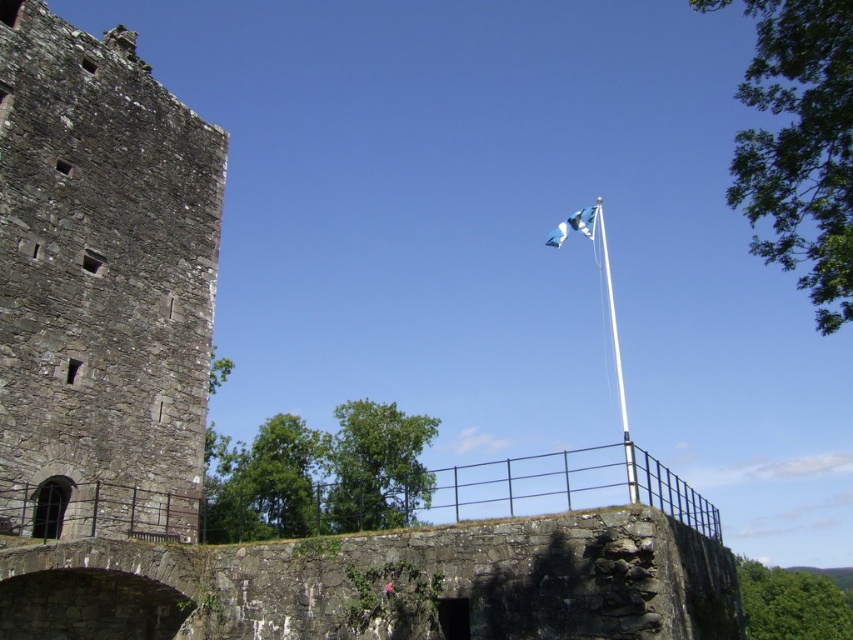
You are an architect examining the historic stone structure. You notice the rough stone tower at left and the white metallic flag pole at upper right. Which object has a smaller width?

The rough stone tower at left has a smaller width than the white metallic flag pole at upper right.

You are an architect examining the historic stone structure. You notice two points marked on the wall. Which point is closer to you, point [608,280] or point [587,228]?

Point [608,280] is closer to you because it is further to the viewer than point [587,228].

You are standing at the center of the historic stone structure. Looking up, you see the white metallic flag pole at upper right. Where exactly is the flag pole located in terms of coordinates?

The white metallic flag pole at upper right is located at coordinates point (616, 358).